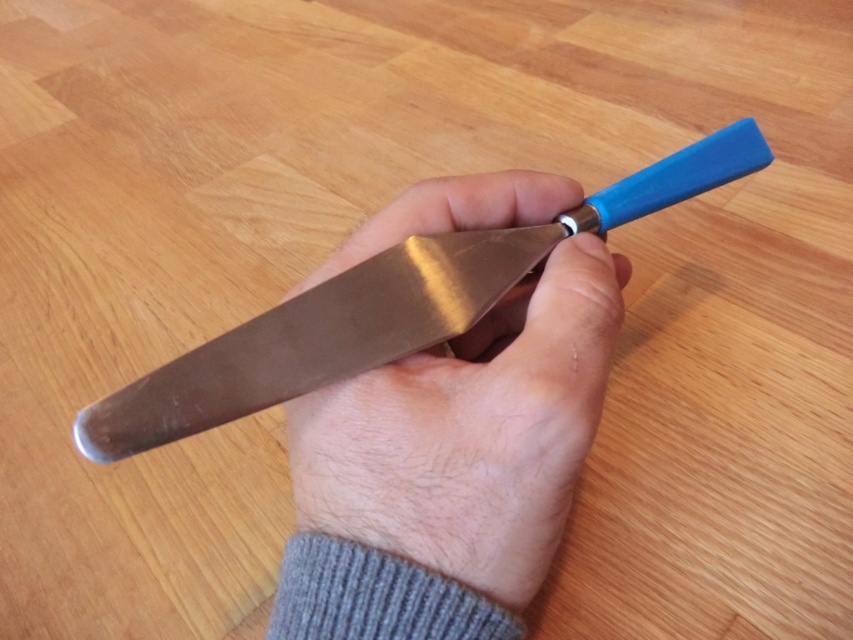
Question: Which point is closer to the camera?

Choices:
 (A) metallic knife at center
 (B) polished metal knife at center

Answer: (B)

Question: Is metallic knife at center smaller than polished metal knife at center?

Choices:
 (A) yes
 (B) no

Answer: (A)

Question: Among these points, which one is farthest from the camera?

Choices:
 (A) (699, 147)
 (B) (492, 392)

Answer: (A)

Question: Can you confirm if metallic knife at center is thinner than polished metal knife at center?

Choices:
 (A) yes
 (B) no

Answer: (A)

Question: Is metallic knife at center wider than polished metal knife at center?

Choices:
 (A) yes
 (B) no

Answer: (B)